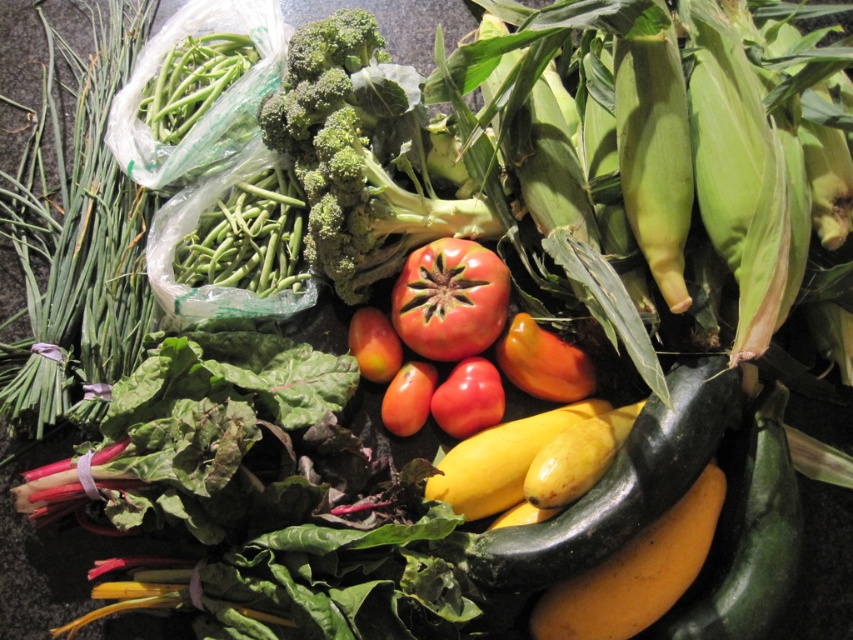
Based on the photo, is yellow smooth squash at center shorter than glossy red tomato at center?

No, yellow smooth squash at center is not shorter than glossy red tomato at center.

Looking at this image, is yellow smooth squash at center wider than glossy red tomato at center?

Yes, yellow smooth squash at center is wider than glossy red tomato at center.

Does point (495, 467) come in front of point (405, 365)?

Yes, it is.

Locate an element on the screen. This screenshot has height=640, width=853. yellow smooth squash at center is located at coordinates (502, 460).

Is red matte tomato at center bigger than smooth red tomato at center?

Yes.

Image resolution: width=853 pixels, height=640 pixels. Find the location of `red matte tomato at center`. red matte tomato at center is located at coordinates (468, 397).

From the picture: Between ripe yellow banana at lower right and glossy red tomato at center, which one has less height?

Standing shorter between the two is glossy red tomato at center.

In the scene shown: Between ripe yellow banana at lower right and glossy red tomato at center, which one is positioned higher?

Positioned higher is glossy red tomato at center.

The image size is (853, 640). What do you see at coordinates (636, 572) in the screenshot?
I see `ripe yellow banana at lower right` at bounding box center [636, 572].

Where is `ripe yellow banana at lower right`? ripe yellow banana at lower right is located at coordinates (636, 572).